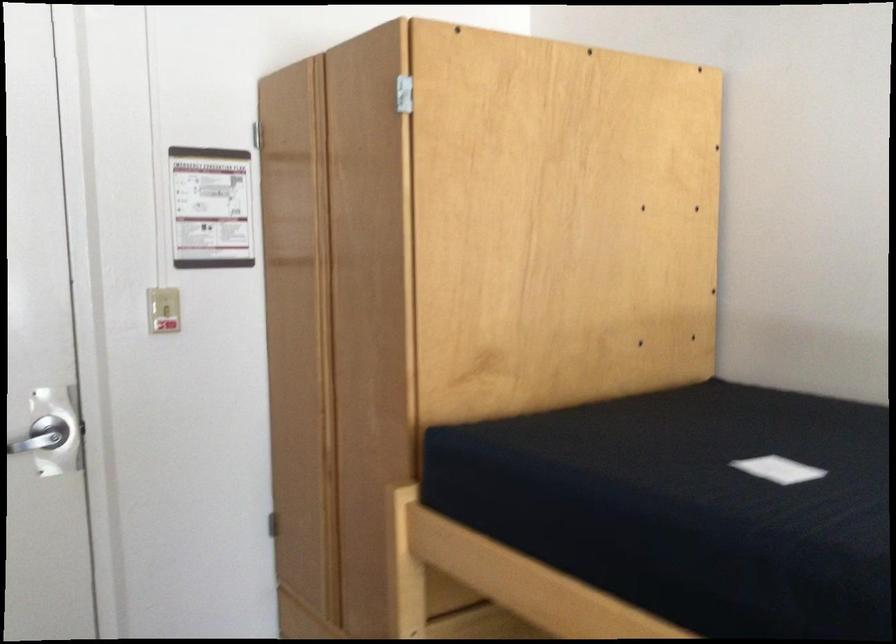
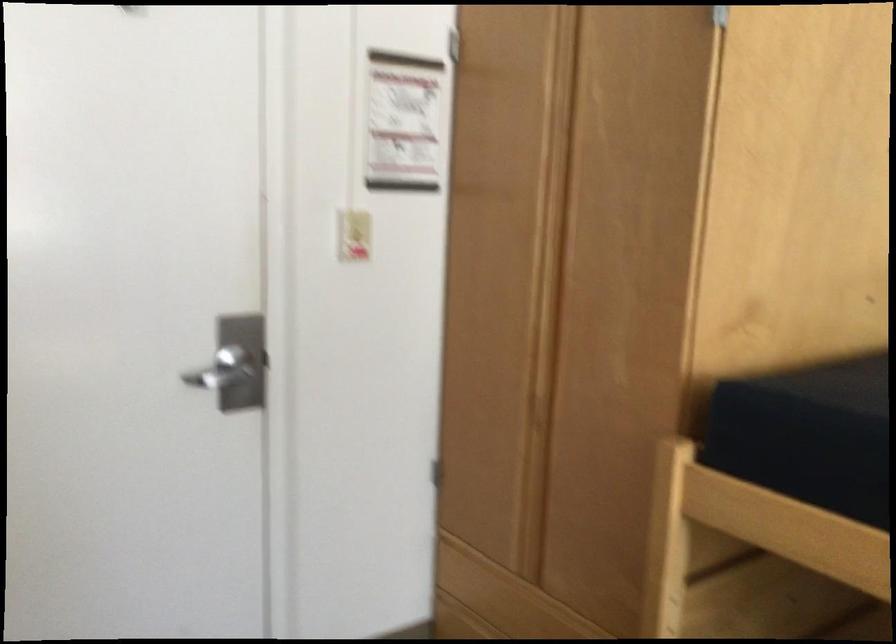
Question: Which direction would the cameraman need to move to produce the second image? Reply with the corresponding letter.

Choices:
 (A) Left
 (B) Right
 (C) Forward
 (D) Backward

Answer: (A)